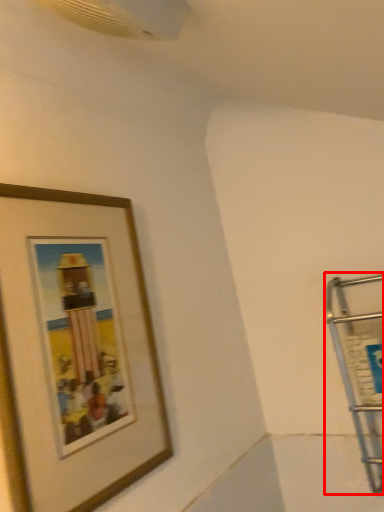
Question: From the image's perspective, what is the correct spatial positioning of cart (annotated by the red box) in reference to picture frame?

Choices:
 (A) below
 (B) above

Answer: (A)